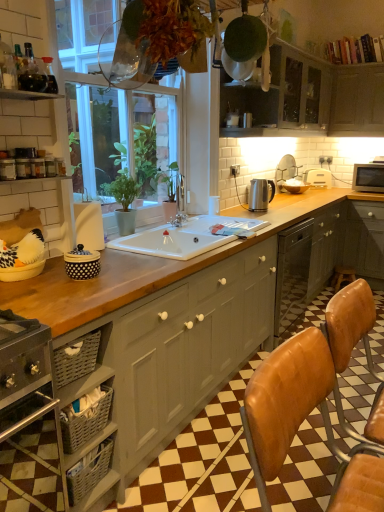
Question: Would you say brown leather bar stool at lower right contains metallic silver kettle at upper center, which is the sixth appliance from right to left?

Choices:
 (A) yes
 (B) no

Answer: (B)

Question: Does brown leather bar stool at lower right lie behind metallic silver kettle at upper center, which is the 6th appliance in back-to-front order?

Choices:
 (A) no
 (B) yes

Answer: (B)

Question: Can you see brown leather bar stool at lower right touching metallic silver kettle at upper center, which is the sixth appliance from right to left?

Choices:
 (A) no
 (B) yes

Answer: (A)

Question: From a real-world perspective, is brown leather bar stool at lower right on metallic silver kettle at upper center, which is the sixth appliance from right to left?

Choices:
 (A) yes
 (B) no

Answer: (B)

Question: From a real-world perspective, is brown leather bar stool at lower right positioned under metallic silver kettle at upper center, which is the sixth appliance from right to left, based on gravity?

Choices:
 (A) no
 (B) yes

Answer: (B)

Question: Would you consider brown leather bar stool at lower right to be distant from metallic silver kettle at upper center, which ranks as the 2th appliance in front-to-back order?

Choices:
 (A) no
 (B) yes

Answer: (B)

Question: From a real-world perspective, does silver metallic kettle at center, which is the 5th appliance in front-to-back order, sit lower than matte black microwave at upper right, marked as the 2th appliance in a back-to-front arrangement?

Choices:
 (A) yes
 (B) no

Answer: (A)

Question: Is matte black microwave at upper right, marked as the first appliance in a right-to-left arrangement, completely or partially inside silver metallic kettle at center, which is the 5th appliance in front-to-back order?

Choices:
 (A) no
 (B) yes

Answer: (A)

Question: Does silver metallic kettle at center, which ranks as the 3th appliance in right-to-left order, have a larger size compared to matte black microwave at upper right, marked as the 2th appliance in a back-to-front arrangement?

Choices:
 (A) yes
 (B) no

Answer: (B)

Question: Is silver metallic kettle at center, the 3th appliance from the back, positioned behind matte black microwave at upper right, marked as the first appliance in a right-to-left arrangement?

Choices:
 (A) no
 (B) yes

Answer: (A)

Question: Can you confirm if silver metallic kettle at center, the fifth appliance from the left, is positioned to the right of matte black microwave at upper right, marked as the seventh appliance in a left-to-right arrangement?

Choices:
 (A) no
 (B) yes

Answer: (A)

Question: From the image's perspective, is silver metallic kettle at center, which is the 5th appliance in front-to-back order, located above matte black microwave at upper right, marked as the first appliance in a right-to-left arrangement?

Choices:
 (A) no
 (B) yes

Answer: (A)

Question: Is metallic silver kettle at upper center, which is the sixth appliance from right to left, to the right of matte black microwave at upper right, marked as the seventh appliance in a left-to-right arrangement, from the viewer's perspective?

Choices:
 (A) yes
 (B) no

Answer: (B)